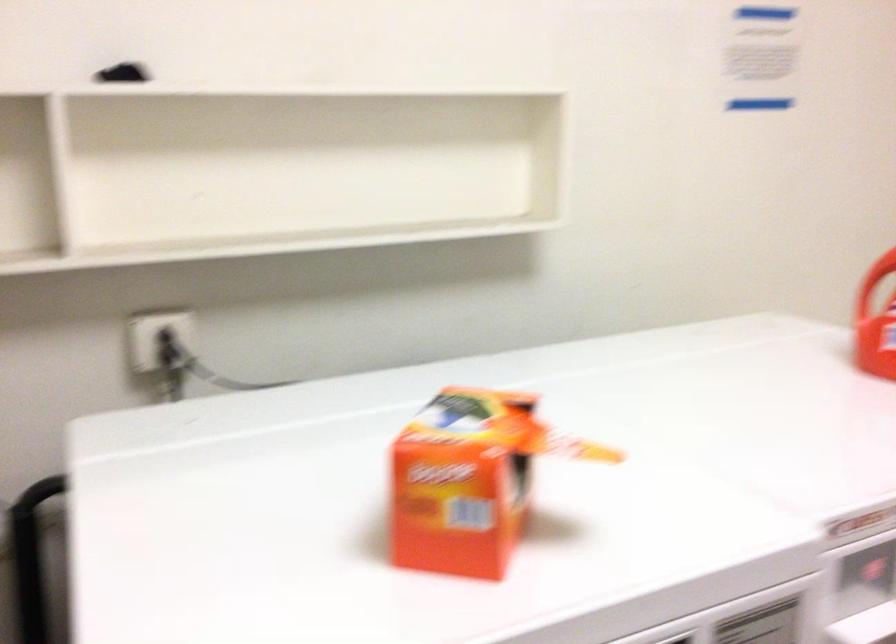
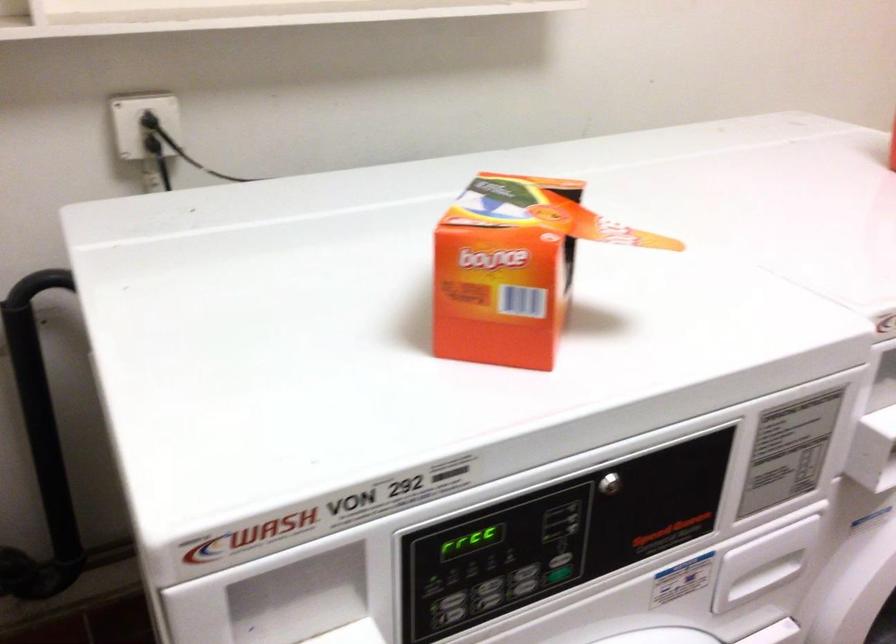
Locate, in the second image, the point that corresponds to point (164, 333) in the first image.

(150, 122)